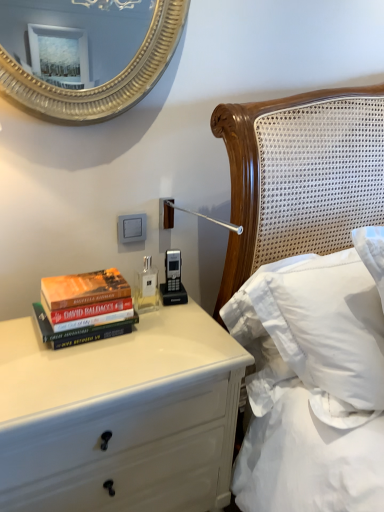
Question: From a real-world perspective, is clear glass bottle at center physically located above or below white soft pillow at upper right?

Choices:
 (A) above
 (B) below

Answer: (A)

Question: From the image's perspective, is clear glass bottle at center located above or below white soft pillow at upper right?

Choices:
 (A) above
 (B) below

Answer: (A)

Question: Which object is the farthest from the hardcover books at left?

Choices:
 (A) white glossy chest of drawers at lower left
 (B) clear glass bottle at center
 (C) white soft pillow at upper right

Answer: (C)

Question: Estimate the real-world distances between objects in this image. Which object is farther from the white soft pillow at upper right?

Choices:
 (A) hardcover books at left
 (B) white glossy chest of drawers at lower left
 (C) clear glass bottle at center

Answer: (A)